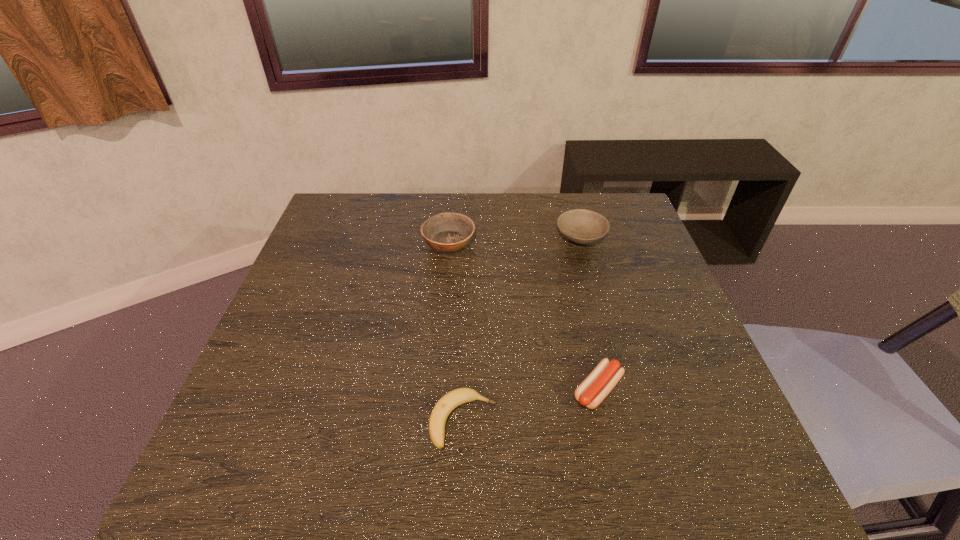
Identify the location of free space between the right bowl and the sausage. Image resolution: width=960 pixels, height=540 pixels. (589, 313).

At what (x,y) coordinates should I click in order to perform the action: click on free space between the banana and the second shortest object. Please return your answer as a coordinate pair (x, y). The height and width of the screenshot is (540, 960). Looking at the image, I should click on (531, 406).

Locate an element on the screen. The width and height of the screenshot is (960, 540). unoccupied position between the banana and the second shortest object is located at coordinates (531, 406).

You are a GUI agent. You are given a task and a screenshot of the screen. Output one action in this format:
    pyautogui.click(x=<x>, y=<y>)
    Task: Click on the vacant space that is in between the left bowl and the right bowl
    
    Given the screenshot: What is the action you would take?
    pyautogui.click(x=515, y=239)

Where is `free spot between the sausage and the right bowl`? free spot between the sausage and the right bowl is located at coordinates (589, 313).

Locate an element on the screen. The width and height of the screenshot is (960, 540). vacant region between the second shortest object and the left bowl is located at coordinates (523, 316).

Where is `vacant space that is in between the left bowl and the sausage`? This screenshot has width=960, height=540. vacant space that is in between the left bowl and the sausage is located at coordinates (523, 316).

Identify which object is the second nearest to the right bowl. Please provide its 2D coordinates. Your answer should be formatted as a tuple, i.e. [(x, y)], where the tuple contains the x and y coordinates of a point satisfying the conditions above.

[(594, 389)]

The height and width of the screenshot is (540, 960). I want to click on object that stands as the third closest to the shorter bowl, so click(453, 399).

The height and width of the screenshot is (540, 960). I want to click on free space that satisfies the following two spatial constraints: 1. on the back side of the right bowl; 2. on the right side of the sausage, so click(563, 236).